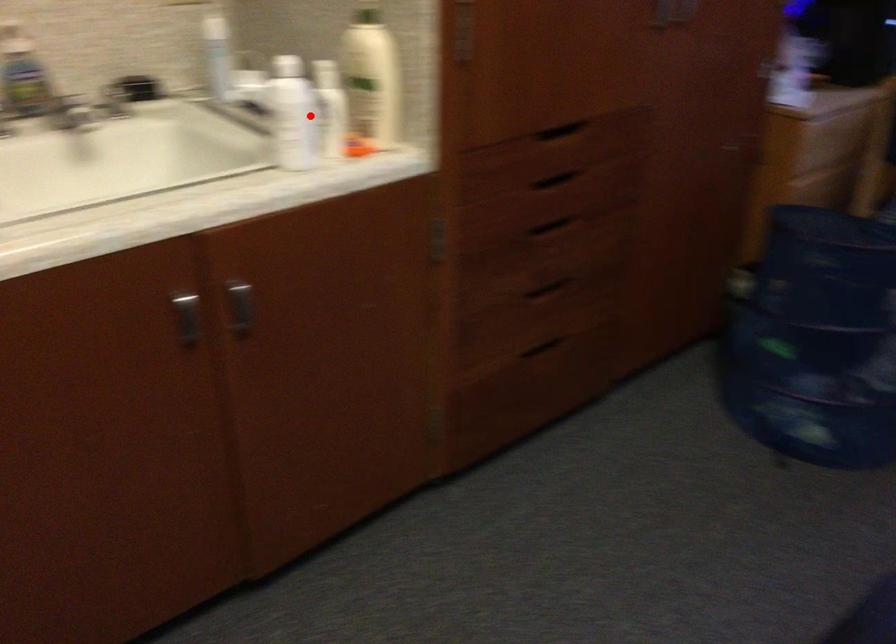
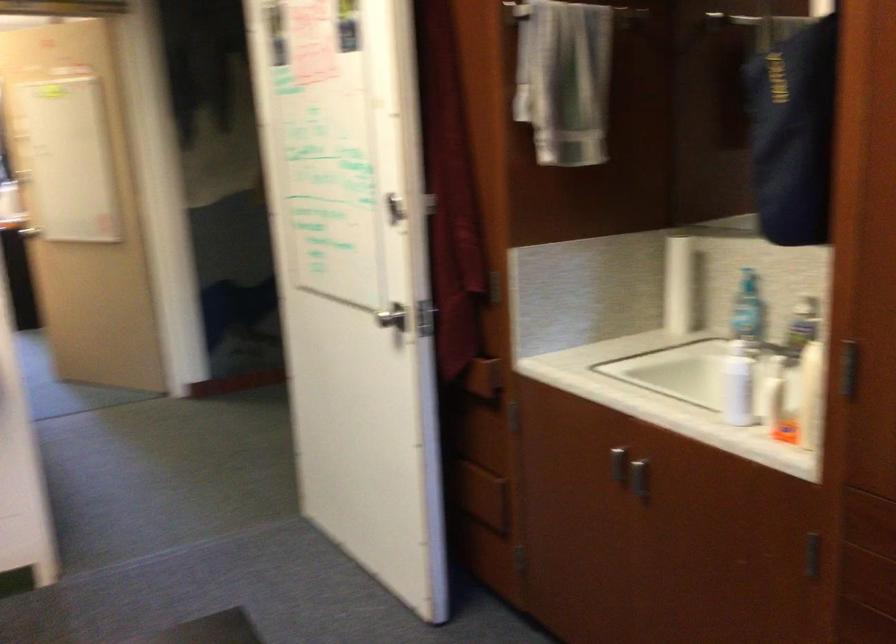
Question: I am providing you with two images of the same scene from different viewpoints. In image1, a red point is highlighted. Considering the same 3D point in image2, which of the following is correct?

Choices:
 (A) It is closer
 (B) It is farther

Answer: (B)